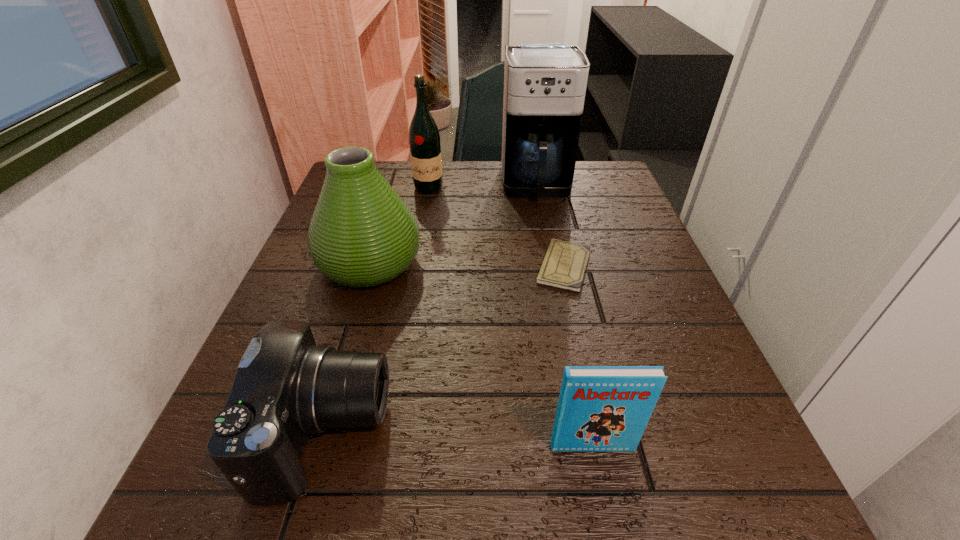
Locate an element on the screen. This screenshot has width=960, height=540. vacant region that satisfies the following two spatial constraints: 1. on the front-facing side of the liquor; 2. on the lens of the camera is located at coordinates (386, 433).

You are a GUI agent. You are given a task and a screenshot of the screen. Output one action in this format:
    pyautogui.click(x=<x>, y=<y>)
    Task: Click on the vacant area that satisfies the following two spatial constraints: 1. on the front-facing side of the second tallest object; 2. on the left side of the shortest object
    Image resolution: width=960 pixels, height=540 pixels.
    Given the screenshot: What is the action you would take?
    pyautogui.click(x=415, y=266)

At what (x,y) coordinates should I click in order to perform the action: click on free region that satisfies the following two spatial constraints: 1. on the front-facing side of the liquor; 2. on the lens of the camera. Please return your answer as a coordinate pair (x, y). The height and width of the screenshot is (540, 960). Looking at the image, I should click on (386, 433).